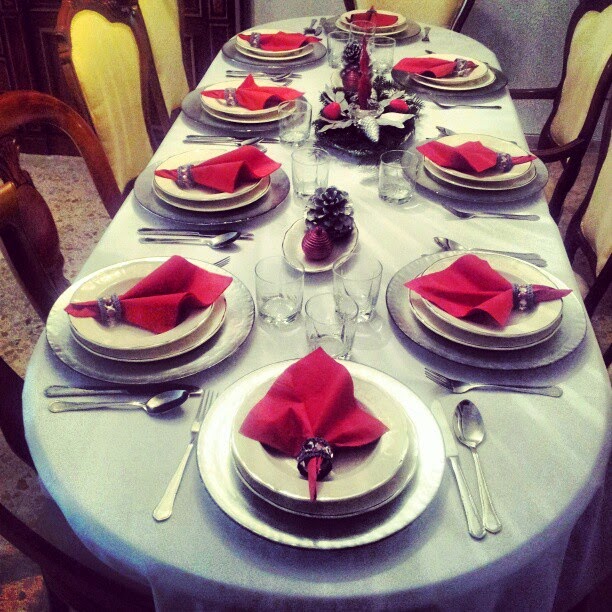
At what (x,y) coordinates should I click in order to perform the action: click on red cloth napkins. Please return your answer as a coordinate pair (x, y). Looking at the image, I should click on (319, 389), (444, 289), (151, 291), (217, 174), (253, 87), (275, 34), (379, 13), (428, 65), (474, 158).